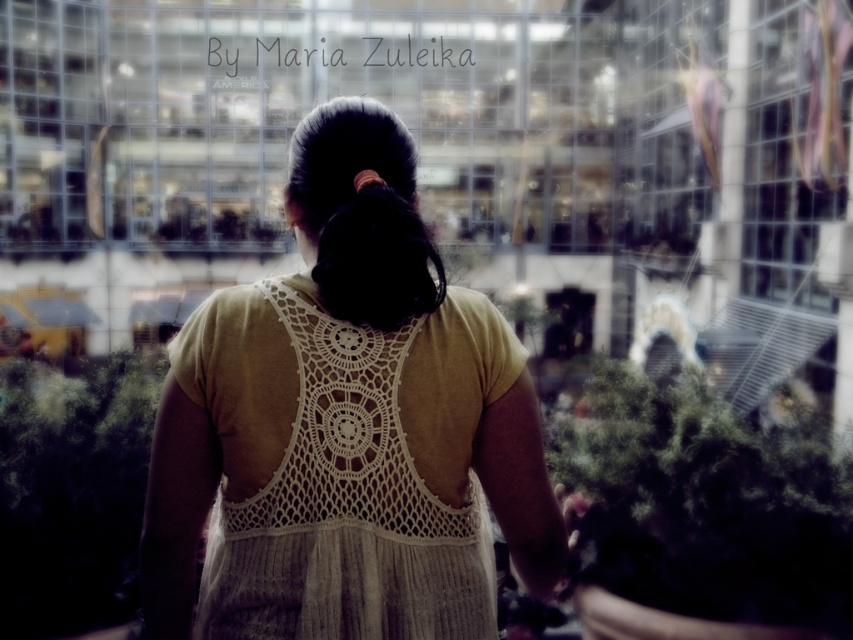
Based on the scene description, where is the white crochet dress at center located in the image?

The white crochet dress at center is located at point 0.727 on the x axis and 0.404 on the y axis.

You are a photographer adjusting your camera settings to focus on the subject in the image. Since the white crochet dress at center and the black silky hair at center are both at the center, which one is positioned lower in the frame?

The white crochet dress at center is below black silky hair at center, so the white crochet dress at center is positioned lower in the frame.